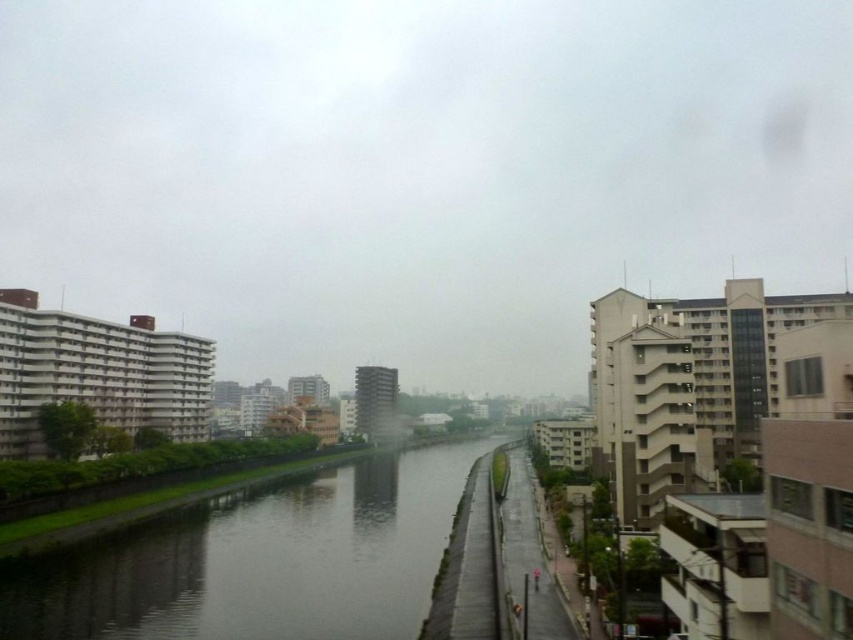
You are an architect designing a new bridge that needs to span the smooth concrete river at center. The bridge must be as wide as the transparent glass sky at upper center. Based on the scene, will the bridge be wider than the river?

The transparent glass sky at upper center is wider than the smooth concrete river at center. Therefore, the bridge designed to match the sky at upper center will indeed be wider than the river.

You are standing on the paved walkway on the right side of the river and want to look up at the transparent glass sky at upper center. Which direction should you turn to face the smooth concrete river at center?

You should turn to your left to face the smooth concrete river at center because the transparent glass sky at upper center is positioned on the left side of smooth concrete river at center.

You are standing on the riverbank and want to take a photo of the transparent glass sky at upper center. If your camera has a maximum focus range of 120 meters, will you be able to capture it clearly?

The transparent glass sky at upper center is 125.96 meters away from the viewer. Since the camera can only focus up to 120 meters, it will not be able to capture the transparent glass sky at upper center clearly.